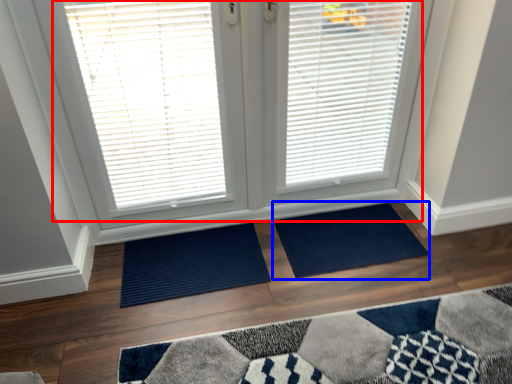
Question: Which object is further to the camera taking this photo, bay window (highlighted by a red box) or doormat (highlighted by a blue box)?

Choices:
 (A) bay window
 (B) doormat

Answer: (B)